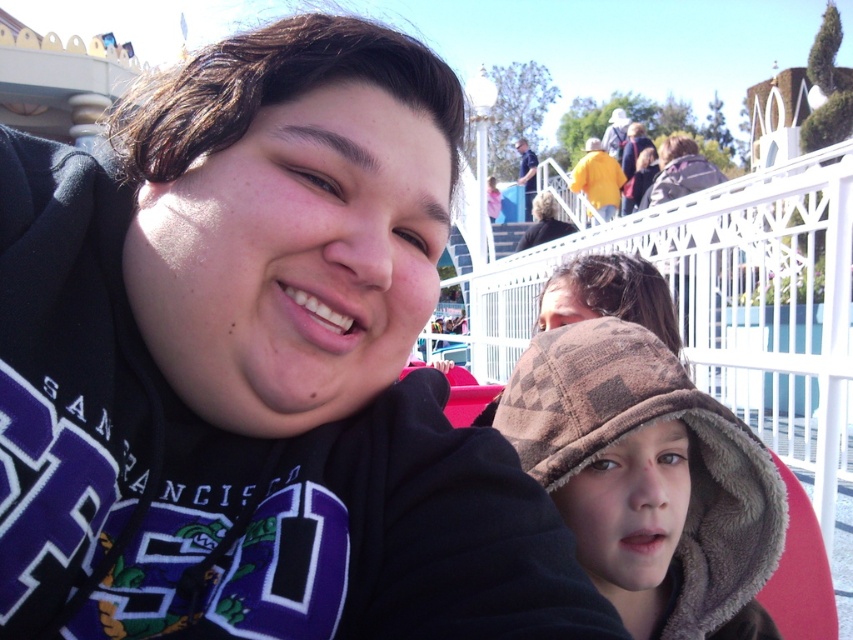
Question: Does brown fleece hat at center appear under dark brown hair at upper center?

Choices:
 (A) no
 (B) yes

Answer: (B)

Question: Which of the following is the farthest from the observer?

Choices:
 (A) (751, 580)
 (B) (548, 211)

Answer: (B)

Question: Can you confirm if brown fleece hat at center is positioned above dark brown hair at upper center?

Choices:
 (A) no
 (B) yes

Answer: (A)

Question: Which object appears farthest from the camera in this image?

Choices:
 (A) dark brown hair at upper center
 (B) brown fleece hat at center

Answer: (A)

Question: Where is brown fleece hat at center located in relation to dark brown hair at upper center in the image?

Choices:
 (A) left
 (B) right

Answer: (A)